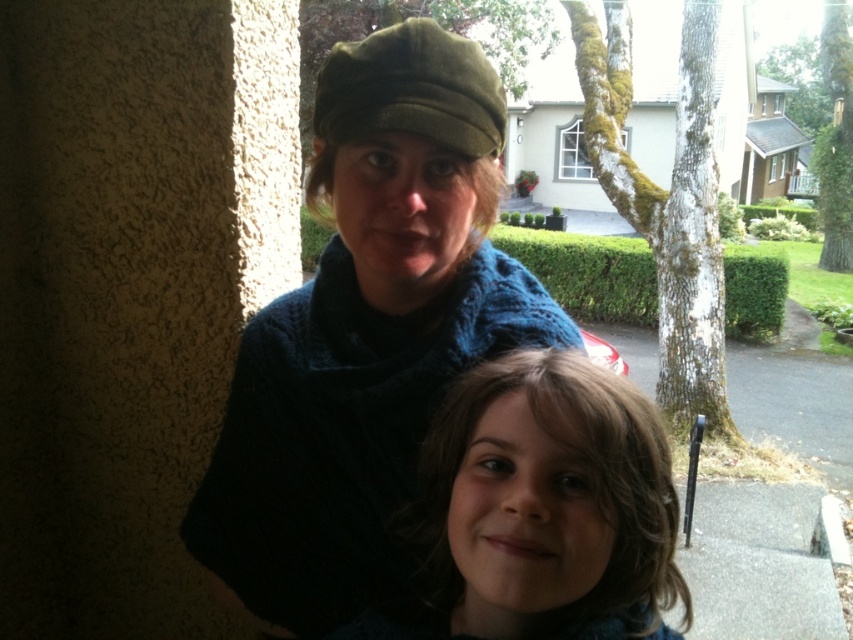
You are a photographer trying to capture both the knitted dark blue sweater at center and the brown curly hair at lower center in a single shot. Given that your camera has a minimum focus distance of 12 inches, will you be able to focus on both subjects clearly?

The distance between the knitted dark blue sweater at center and the brown curly hair at lower center is 10.38 inches. Since this distance is less than the camera minimum focus distance of 12 inches, the camera can focus on both subjects clearly.

You are a photographer trying to capture a clear shot of both the knitted dark blue sweater at center and the brown curly hair at lower center. Which object should you focus on first to ensure it appears sharp in the photo?

The knitted dark blue sweater at center is much taller than the brown curly hair at lower center, so you should focus on the knitted dark blue sweater at center first to ensure it appears sharp in the photo.